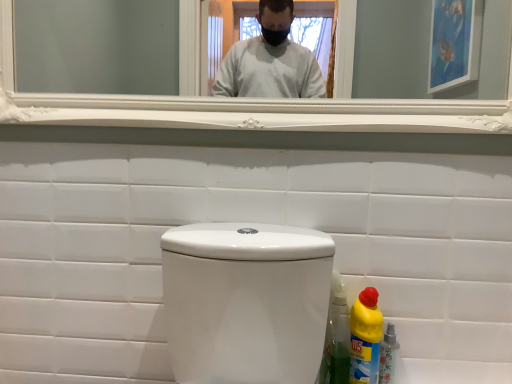
Question: From the image's perspective, is white glossy toilet at center located above or below white glossy mirror at upper center?

Choices:
 (A) above
 (B) below

Answer: (B)

Question: Is white glossy toilet at center to the left or to the right of white glossy mirror at upper center in the image?

Choices:
 (A) right
 (B) left

Answer: (B)

Question: Considering the real-world distances, which object is farthest from the white glossy mirror at upper center?

Choices:
 (A) white glossy toilet at center
 (B) yellow plastic bottle at lower right, which is counted as the first bottle, starting from the right
 (C) yellow plastic bottle at lower right, which appears as the 2th bottle when viewed from the right

Answer: (B)

Question: Based on their relative distances, which object is farther from the yellow plastic bottle at lower right, which is counted as the first bottle, starting from the right?

Choices:
 (A) white glossy toilet at center
 (B) yellow plastic bottle at lower right, which appears as the 2th bottle when viewed from the right
 (C) white glossy mirror at upper center

Answer: (C)